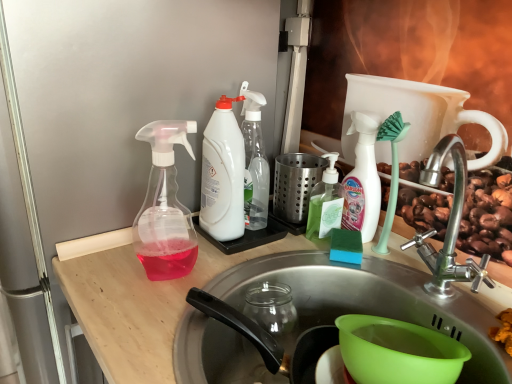
Find the location of a particular element. The width and height of the screenshot is (512, 384). free location to the left of white matte bottle at center, marked as the 1th bottle in a right-to-left arrangement is located at coordinates (276, 248).